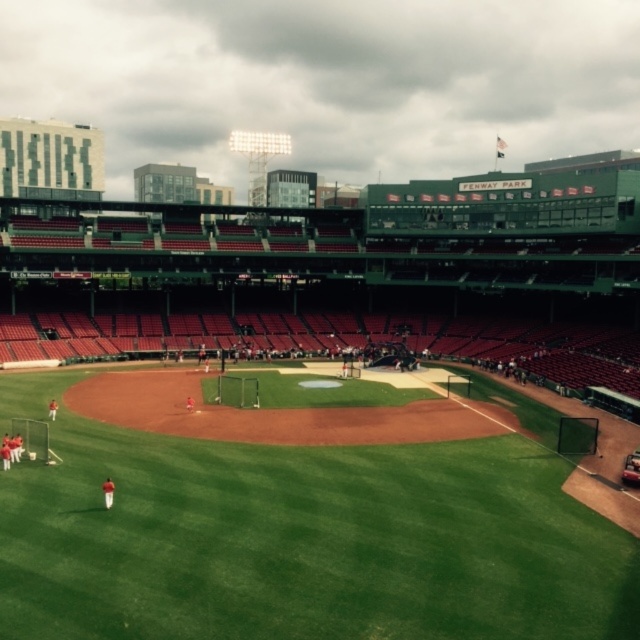
Question: Does green grass field at center appear on the left side of orange uniformed players at lower left?

Choices:
 (A) no
 (B) yes

Answer: (A)

Question: Which object is farther from the camera taking this photo?

Choices:
 (A) green grass field at center
 (B) orange uniformed players at lower left

Answer: (B)

Question: Is green grass field at center behind orange uniformed players at lower left?

Choices:
 (A) yes
 (B) no

Answer: (B)

Question: Does green grass field at center have a greater width compared to orange uniformed players at lower left?

Choices:
 (A) yes
 (B) no

Answer: (A)